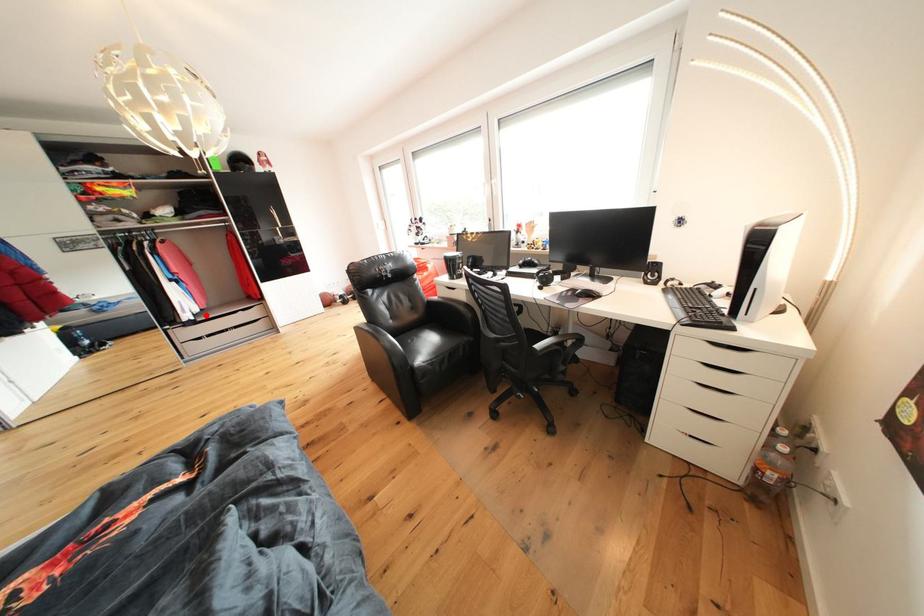
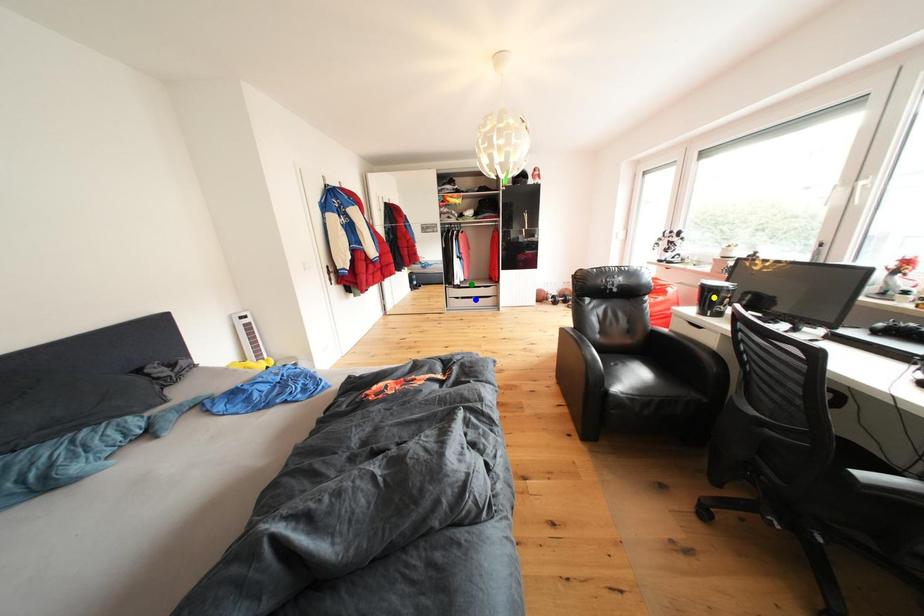
Question: I am providing you with two images of the same scene from different viewpoints. A red point is marked on the first image. You are given multiple points on the second image. Can you choose the point in image 2 that corresponds to the point in image 1?

Choices:
 (A) yellow point
 (B) blue point
 (C) green point

Answer: (C)